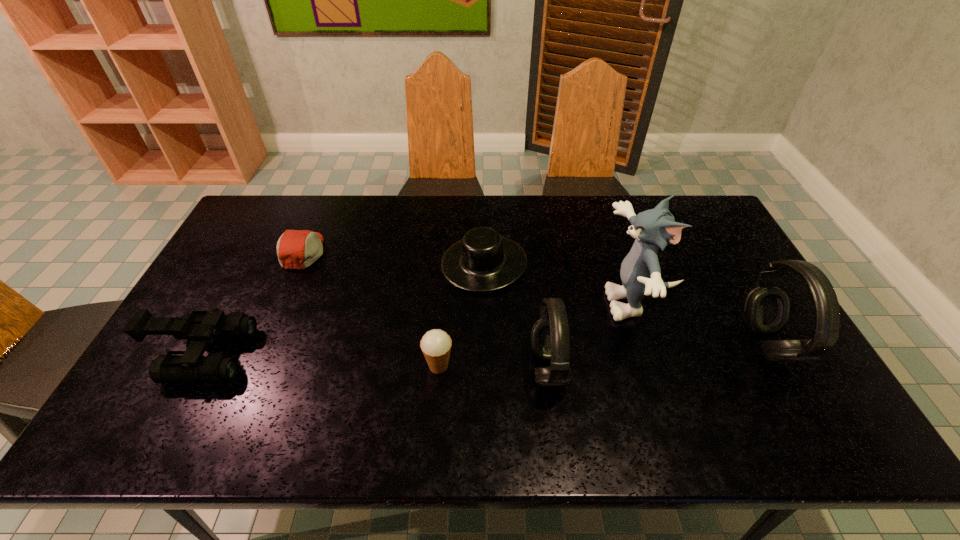
Where is `free space located 0.120m on the earcups of the shorter headset`? This screenshot has height=540, width=960. free space located 0.120m on the earcups of the shorter headset is located at coordinates (484, 368).

The image size is (960, 540). Find the location of `vacant space located on the earcups of the shorter headset`. vacant space located on the earcups of the shorter headset is located at coordinates (445, 368).

I want to click on free region located 0.050m on the earcups of the shorter headset, so click(512, 368).

Locate an element on the screen. This screenshot has width=960, height=540. vacant space positioned on the front-facing side of the shortest object is located at coordinates (447, 252).

This screenshot has width=960, height=540. In order to click on vacant space located on the front-facing side of the cat in this screenshot , I will do `click(530, 303)`.

Find the location of a particular element. Image resolution: width=960 pixels, height=540 pixels. vacant area located on the front-facing side of the cat is located at coordinates (530, 303).

At what (x,y) coordinates should I click in order to perform the action: click on vacant region located on the front-facing side of the cat. Please return your answer as a coordinate pair (x, y). Looking at the image, I should click on (489, 303).

The width and height of the screenshot is (960, 540). I want to click on vacant space situated on the front of the sixth tallest object, so click(x=484, y=319).

Locate an element on the screen. vacant space situated 0.400m on the back of the icecream is located at coordinates (447, 252).

The height and width of the screenshot is (540, 960). What are the coordinates of `blank space located on the front lenses of the binoculars` in the screenshot? It's located at (339, 355).